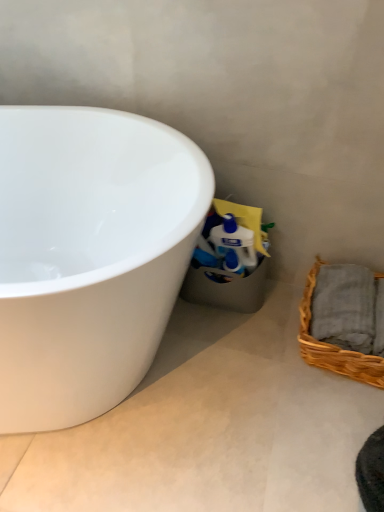
Question: From a real-world perspective, relative to white glossy bathtub at left, is white glossy concrete at lower left vertically above or below?

Choices:
 (A) above
 (B) below

Answer: (B)

Question: Based on their sizes in the image, would you say white glossy concrete at lower left is bigger or smaller than white glossy bathtub at left?

Choices:
 (A) big
 (B) small

Answer: (B)

Question: Which object is the closest to the white glossy bathtub at left?

Choices:
 (A) woven brown picnic basket at lower right
 (B) white glossy concrete at lower left

Answer: (B)

Question: Which of these objects is positioned closest to the white glossy concrete at lower left?

Choices:
 (A) woven brown picnic basket at lower right
 (B) white glossy bathtub at left

Answer: (A)